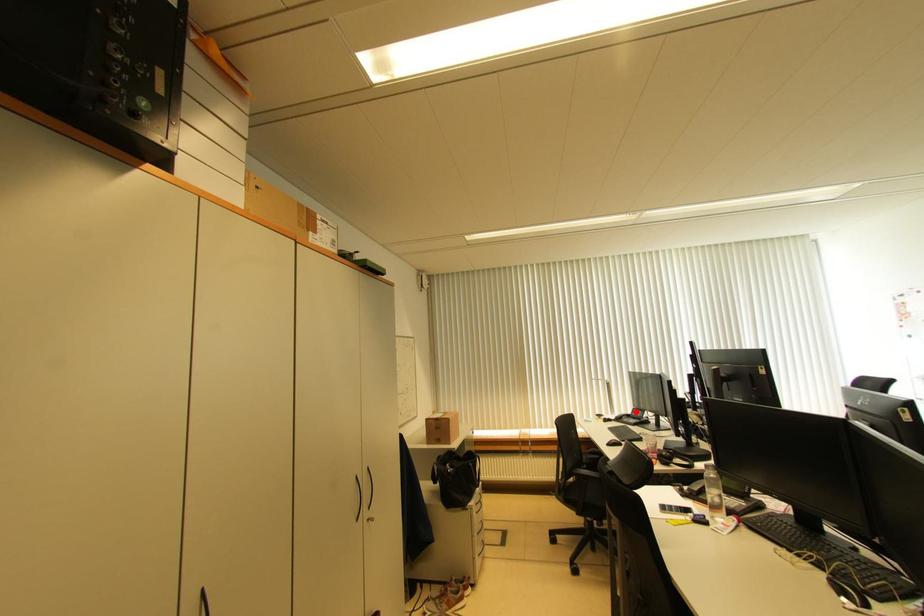
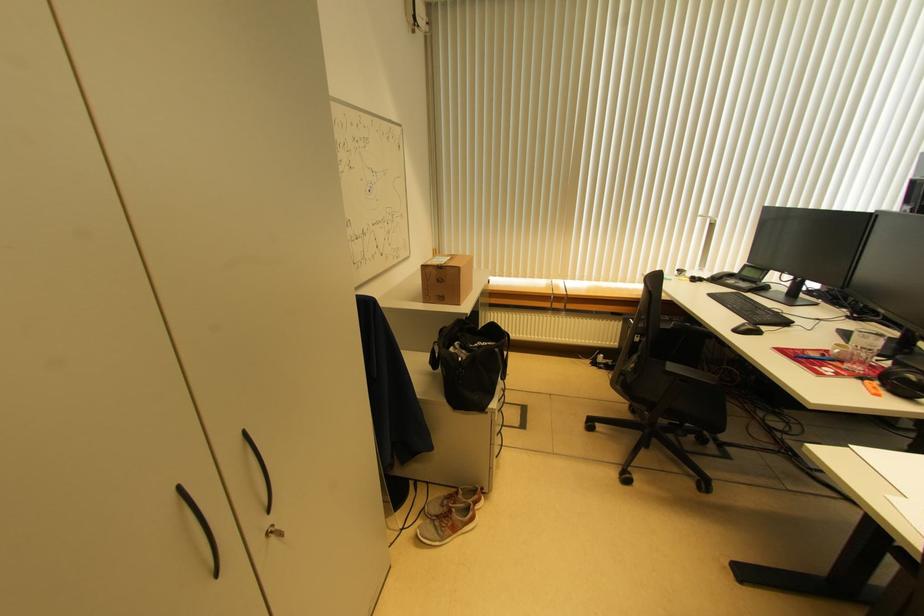
In the second image, find the point that corresponds to the highlighted location in the first image.

(748, 269)